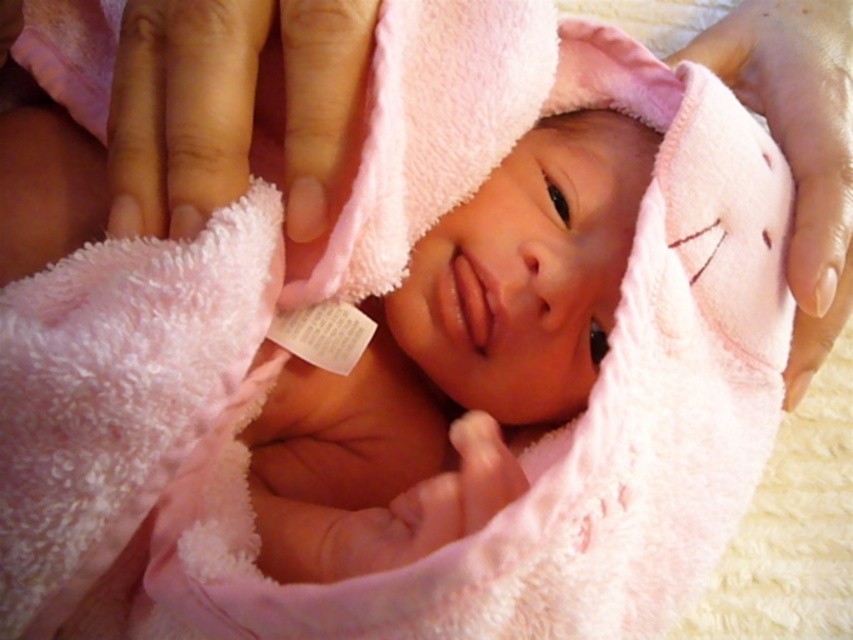
You are a photographer taking a close up of a newborn baby. You notice the smooth pink towel at upper left and the pink soft towel at upper center. Which towel is covering the other?

The smooth pink towel at upper left is positioned over the pink soft towel at upper center, so it is covering the other.

You are a photographer taking a close up of a newborn baby wrapped in a soft pink towel. You notice a point at coordinates (229, 108). Based on the image, where is this point located in relation to the smooth pink towel at upper left?

The point at coordinates (229, 108) is on the smooth pink towel at upper left.